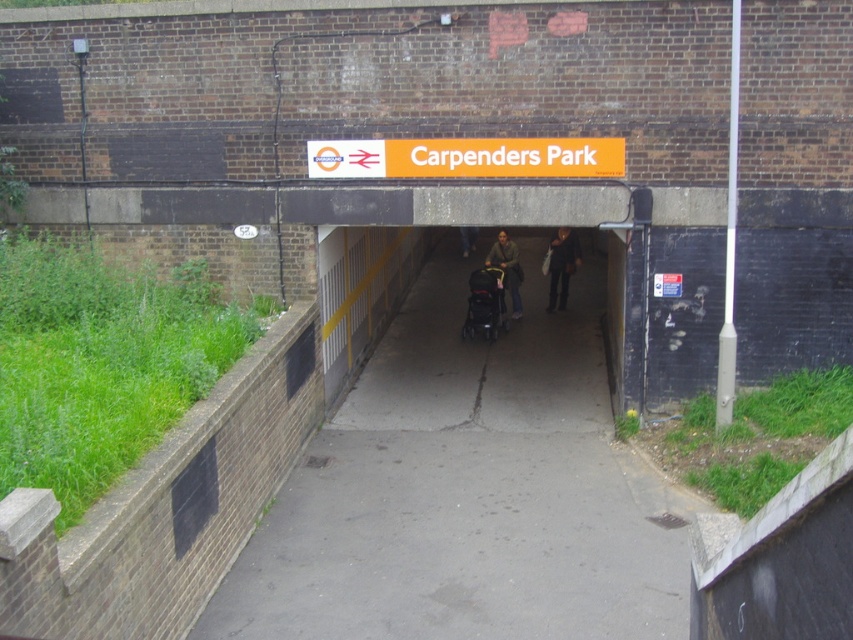
Between point (338, 161) and point (474, 248), which one is positioned in front?

Positioned in front is point (338, 161).

Who is shorter, orange plastic sign at upper center or dark blue jeans at center?

orange plastic sign at upper center is shorter.

The width and height of the screenshot is (853, 640). I want to click on orange plastic sign at upper center, so click(x=467, y=157).

This screenshot has width=853, height=640. What are the coordinates of `orange plastic sign at upper center` in the screenshot? It's located at (467, 157).

Does dark gray fabric jacket at center come behind dark blue jeans at center?

Yes, it is behind dark blue jeans at center.

Which is behind, point (550, 280) or point (465, 244)?

The point (465, 244) is more distant.

Does point (549, 244) lie in front of point (474, 244)?

Yes, point (549, 244) is closer to viewer.

This screenshot has height=640, width=853. What are the coordinates of `dark gray fabric jacket at center` in the screenshot? It's located at (561, 266).

Is orange plastic sign at upper center in front of black plastic baby carriage at center?

That is True.

At what (x,y) coordinates should I click in order to perform the action: click on orange plastic sign at upper center. Please return your answer as a coordinate pair (x, y). Looking at the image, I should click on (467, 157).

Find the location of a particular element. orange plastic sign at upper center is located at coordinates (467, 157).